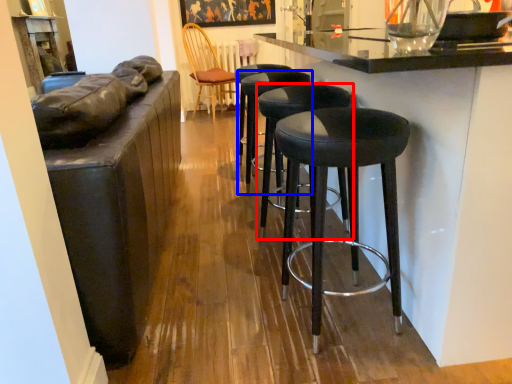
Question: Which point is closer to the camera, stool (highlighted by a red box) or stool (highlighted by a blue box)?

Choices:
 (A) stool
 (B) stool

Answer: (A)